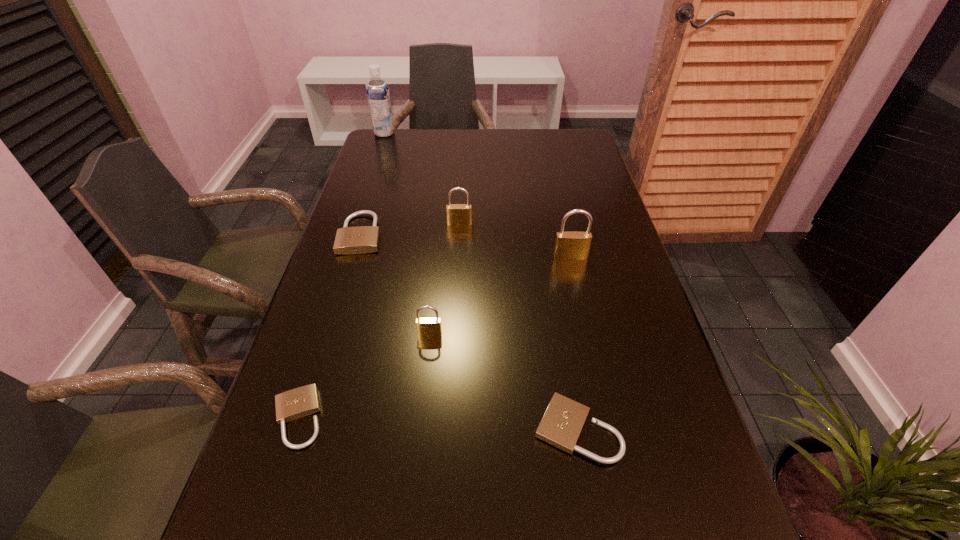
Locate which brass padlock is the closest to the tallest object. Please provide its 2D coordinates. Your answer should be formatted as a tuple, i.e. [(x, y)], where the tuple contains the x and y coordinates of a point satisfying the conditions above.

[(457, 214)]

Where is `beige padlock that is the third closest to the farthest brass padlock`? This screenshot has height=540, width=960. beige padlock that is the third closest to the farthest brass padlock is located at coordinates (303, 401).

I want to click on the second closest beige padlock to the shortest object, so click(363, 239).

The height and width of the screenshot is (540, 960). In order to click on free space in the image that satisfies the following two spatial constraints: 1. on the label of the soya milk; 2. on the left side of the shortest padlock in this screenshot , I will do `click(288, 418)`.

The height and width of the screenshot is (540, 960). I want to click on vacant space that satisfies the following two spatial constraints: 1. on the back side of the smallest beige padlock; 2. on the label of the tallest object, so click(x=389, y=133).